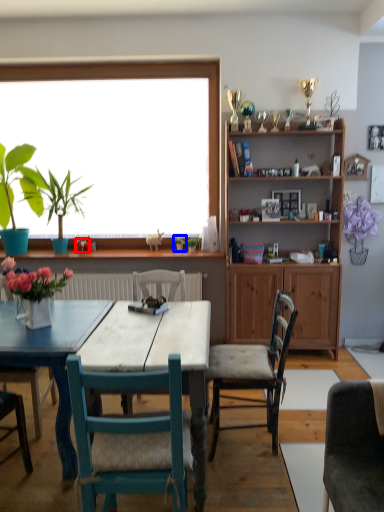
Question: Which object appears farthest to the camera in this image, flower (highlighted by a red box) or plant (highlighted by a blue box)?

Choices:
 (A) flower
 (B) plant

Answer: (B)